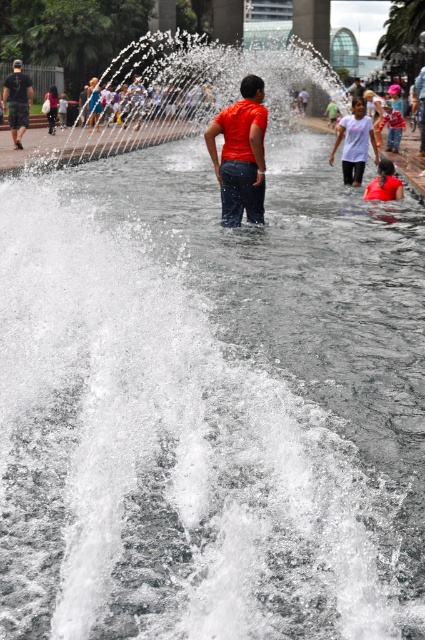
You are standing at the public water feature and want to know if the point closer to you is the one at coordinates point (232, 120) or point (14, 97). Which point is closer?

Point (232, 120) is closer to the viewer than point (14, 97).